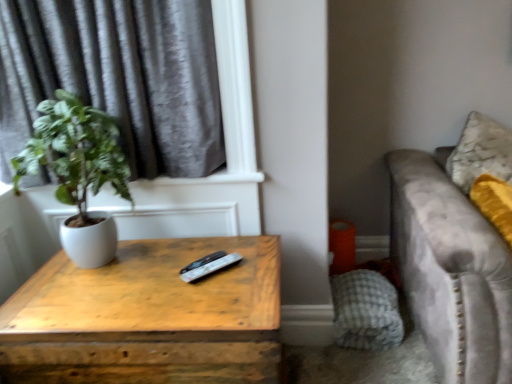
Question: Considering the positions of black plastic remote at center and gray velvet curtain at upper left in the image, is black plastic remote at center taller or shorter than gray velvet curtain at upper left?

Choices:
 (A) short
 (B) tall

Answer: (A)

Question: From the image's perspective, is black plastic remote at center above or below gray velvet curtain at upper left?

Choices:
 (A) above
 (B) below

Answer: (B)

Question: Based on their relative distances, which object is nearer to the gray velvet curtain at upper left?

Choices:
 (A) velvet gray couch at right
 (B) wooden table at center
 (C) black plastic remote at center
 (D) white matte pot at left
 (E) gray checkered pillow at lower right

Answer: (D)

Question: Which object is positioned closest to the gray checkered pillow at lower right?

Choices:
 (A) black plastic remote at center
 (B) wooden table at center
 (C) velvet gray couch at right
 (D) gray velvet curtain at upper left
 (E) white matte pot at left

Answer: (C)